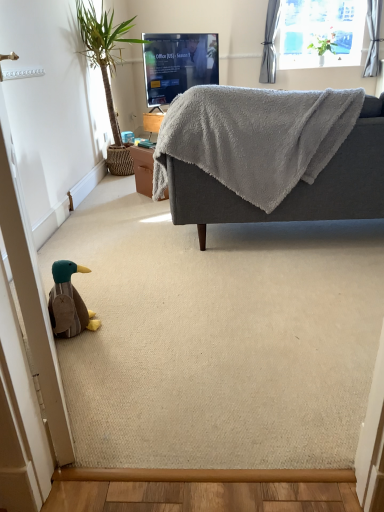
Question: Is matte black tv at upper center not inside gray fabric curtain at upper right?

Choices:
 (A) no
 (B) yes

Answer: (B)

Question: From a real-world perspective, is matte black tv at upper center positioned over gray fabric curtain at upper right based on gravity?

Choices:
 (A) yes
 (B) no

Answer: (B)

Question: Is matte black tv at upper center taller than gray fabric curtain at upper right?

Choices:
 (A) yes
 (B) no

Answer: (B)

Question: Can you confirm if matte black tv at upper center is wider than gray fabric curtain at upper right?

Choices:
 (A) no
 (B) yes

Answer: (B)

Question: Does matte black tv at upper center appear on the left side of gray fabric curtain at upper right?

Choices:
 (A) no
 (B) yes

Answer: (B)

Question: Can gray fabric curtain at upper right be found inside matte black tv at upper center?

Choices:
 (A) no
 (B) yes

Answer: (A)

Question: Is green leafy plant at upper right taller than gray fabric curtain at upper right?

Choices:
 (A) no
 (B) yes

Answer: (A)

Question: Considering the relative positions of green leafy plant at upper right and gray fabric curtain at upper right in the image provided, is green leafy plant at upper right to the left of gray fabric curtain at upper right from the viewer's perspective?

Choices:
 (A) yes
 (B) no

Answer: (B)

Question: Can you confirm if green leafy plant at upper right is positioned to the right of gray fabric curtain at upper right?

Choices:
 (A) no
 (B) yes

Answer: (B)

Question: Considering the relative positions of green leafy plant at upper right and gray fabric curtain at upper right in the image provided, is green leafy plant at upper right behind gray fabric curtain at upper right?

Choices:
 (A) yes
 (B) no

Answer: (A)

Question: Is gray fabric curtain at upper right at the back of green leafy plant at upper right?

Choices:
 (A) no
 (B) yes

Answer: (A)

Question: Is the surface of green leafy plant at upper right in direct contact with gray fabric curtain at upper right?

Choices:
 (A) no
 (B) yes

Answer: (A)

Question: Is transparent glass window at upper center not close to brown plush duck at lower left?

Choices:
 (A) yes
 (B) no

Answer: (A)